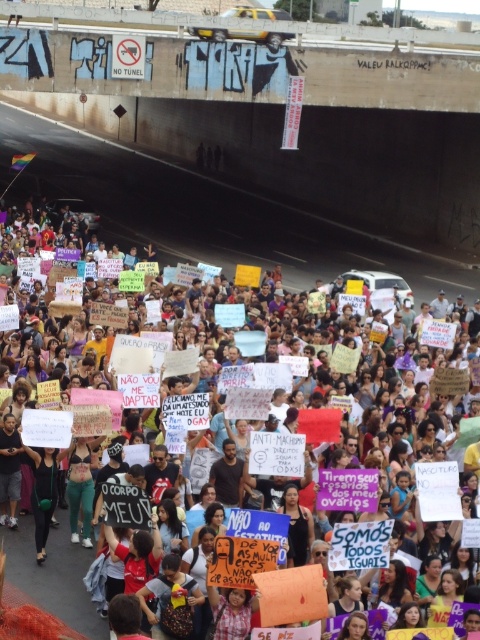
Question: Which point is farther from the camera taking this photo?

Choices:
 (A) (285, 209)
 (B) (58, 595)

Answer: (A)

Question: Can you confirm if brown concrete highway at upper center is positioned below white paper sign at center?

Choices:
 (A) yes
 (B) no

Answer: (B)

Question: Which of the following is the closest to the observer?

Choices:
 (A) (61, 588)
 (B) (408, 236)

Answer: (A)

Question: Does brown concrete highway at upper center appear on the right side of white paper sign at center?

Choices:
 (A) no
 (B) yes

Answer: (A)

Question: In this image, where is brown concrete highway at upper center located relative to white paper sign at center?

Choices:
 (A) below
 (B) above

Answer: (B)